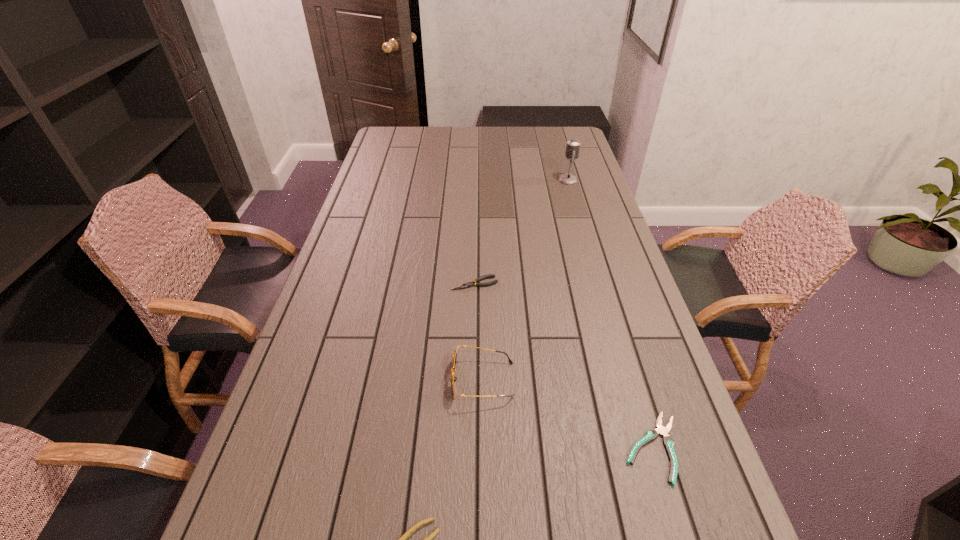
Where is `blank region between the tallest pliers and the farthest object`? blank region between the tallest pliers and the farthest object is located at coordinates (521, 232).

Identify the location of empty space that is in between the farthest object and the second farthest object. This screenshot has width=960, height=540. (521, 232).

Find the location of `vacant point located between the fourth shortest object and the rightmost pliers`. vacant point located between the fourth shortest object and the rightmost pliers is located at coordinates (567, 414).

You are a GUI agent. You are given a task and a screenshot of the screen. Output one action in this format:
    pyautogui.click(x=<x>, y=<y>)
    Task: Click on the vacant space that's between the microphone and the second nearest object
    Image resolution: width=960 pixels, height=540 pixels.
    Given the screenshot: What is the action you would take?
    pyautogui.click(x=611, y=314)

Find the location of a particular element. The image size is (960, 540). free space between the third nearest object and the second nearest pliers is located at coordinates (567, 414).

Locate which object ranks second in proximity to the third farthest object. Please provide its 2D coordinates. Your answer should be formatted as a tuple, i.e. [(x, y)], where the tuple contains the x and y coordinates of a point satisfying the conditions above.

[(403, 539)]

Find the location of a particular element. The width and height of the screenshot is (960, 540). object that is the second closest to the second nearest object is located at coordinates (x=403, y=539).

Choose which pliers is the second nearest neighbor to the second nearest pliers. Please provide its 2D coordinates. Your answer should be formatted as a tuple, i.e. [(x, y)], where the tuple contains the x and y coordinates of a point satisfying the conditions above.

[(469, 284)]

Select which pliers is the closest to the nearest pliers. Please provide its 2D coordinates. Your answer should be formatted as a tuple, i.e. [(x, y)], where the tuple contains the x and y coordinates of a point satisfying the conditions above.

[(652, 434)]

The width and height of the screenshot is (960, 540). Identify the location of vacant region that satisfies the following two spatial constraints: 1. on the front-facing side of the fourth shortest object; 2. on the left side of the rightmost pliers. (483, 448).